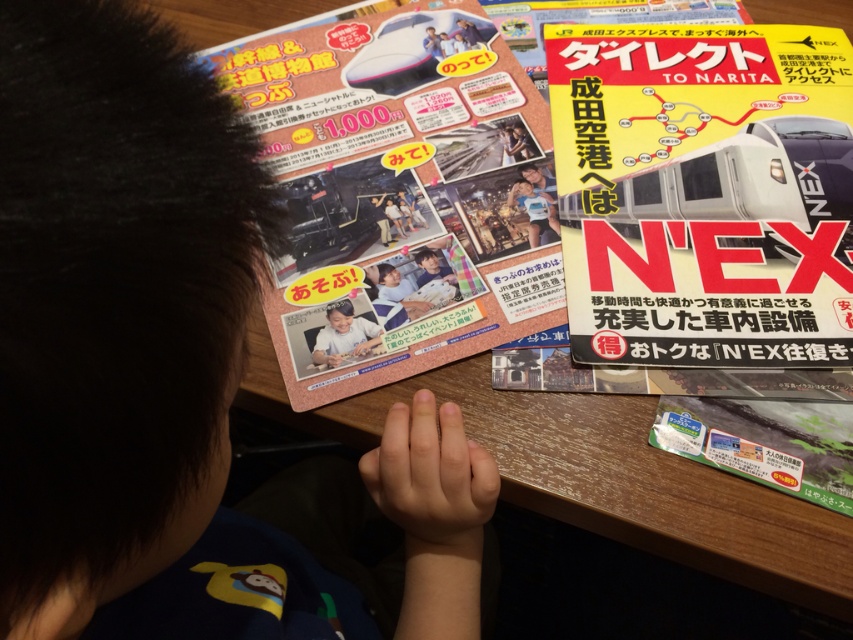
Between yellow paper magazine at upper right and matte pink brochure at upper left, which one is positioned lower?

matte pink brochure at upper left

Find the location of a particular element. Image resolution: width=853 pixels, height=640 pixels. yellow paper magazine at upper right is located at coordinates (705, 193).

Find the location of `yellow paper magazine at upper right`. yellow paper magazine at upper right is located at coordinates (705, 193).

Between point (88, 225) and point (296, 301), which one is positioned in front?

Positioned in front is point (88, 225).

Is dark brown hair at upper left closer to camera compared to matte pink brochure at upper left?

Yes, dark brown hair at upper left is closer to the viewer.

Is point (177, 627) positioned behind point (537, 116)?

That is False.

Image resolution: width=853 pixels, height=640 pixels. In order to click on dark brown hair at upper left in this screenshot , I will do `click(131, 342)`.

Where is `dark brown hair at upper left`? This screenshot has width=853, height=640. dark brown hair at upper left is located at coordinates (131, 342).